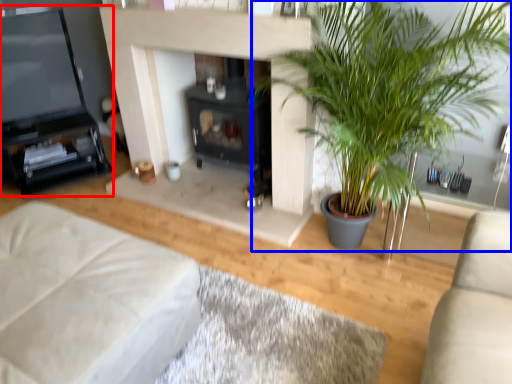
Question: Which point is further to the camera, entertainment center (highlighted by a red box) or houseplant (highlighted by a blue box)?

Choices:
 (A) entertainment center
 (B) houseplant

Answer: (A)